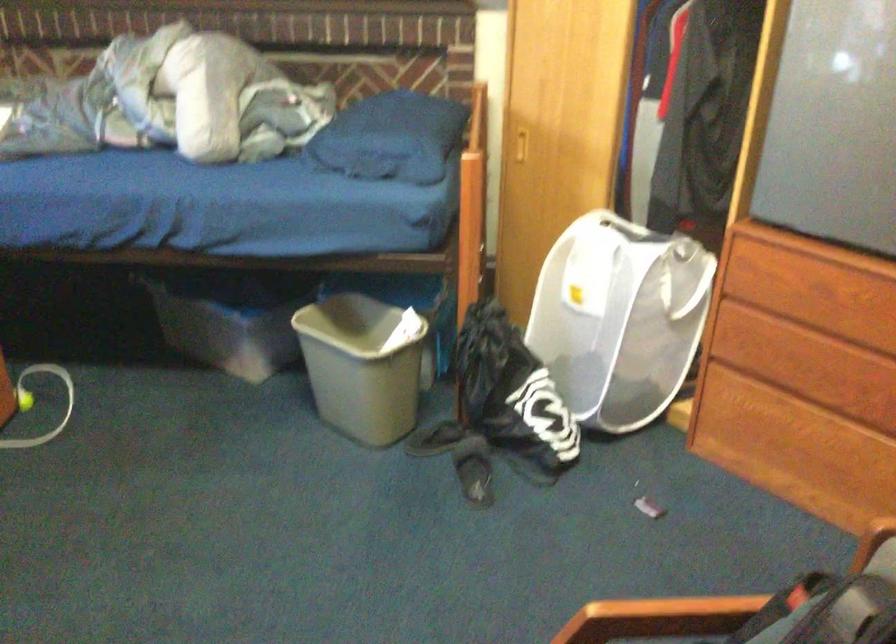
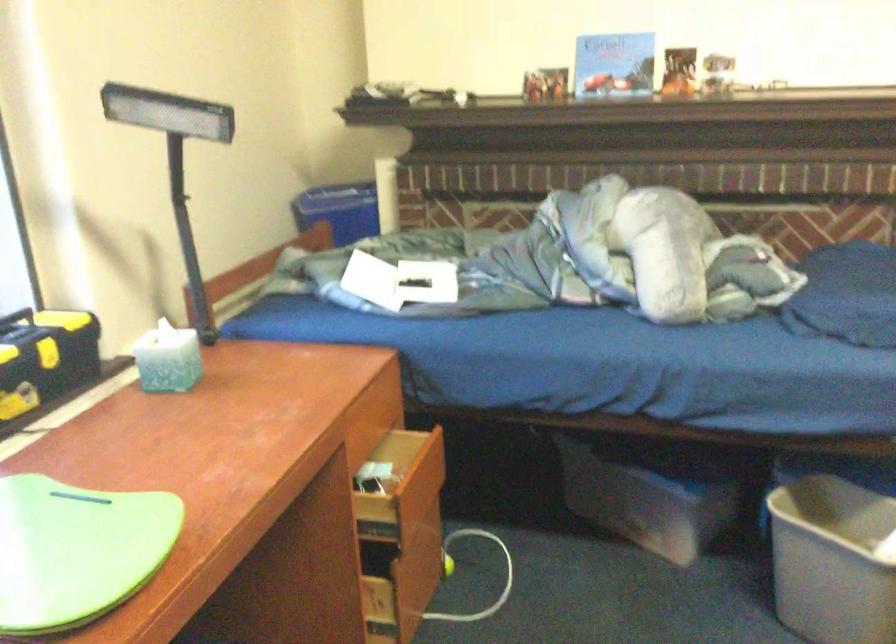
Where in the second image is the point corresponding to point 337,365 from the first image?

(832, 561)